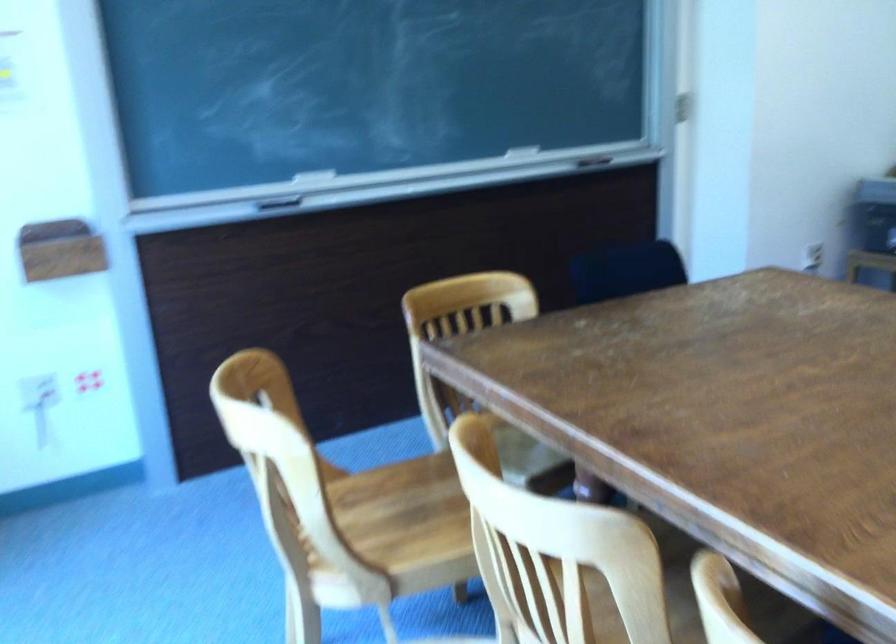
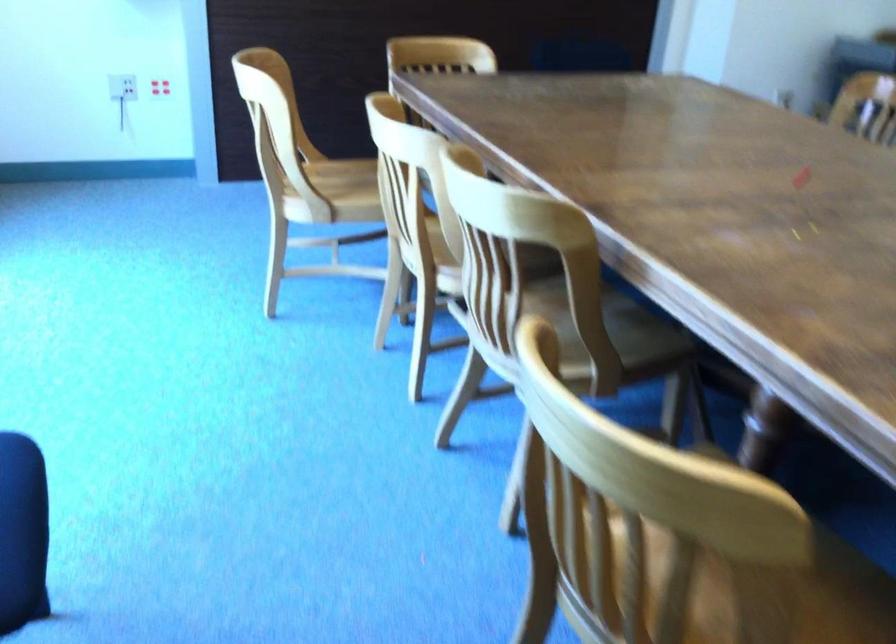
Find the pixel in the second image that matches the point at 391,509 in the first image.

(347, 180)